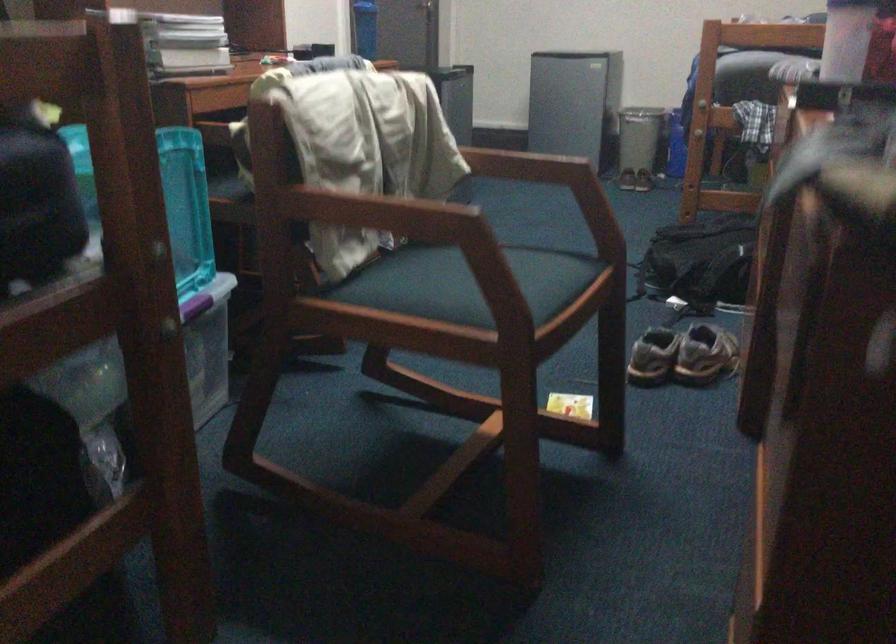
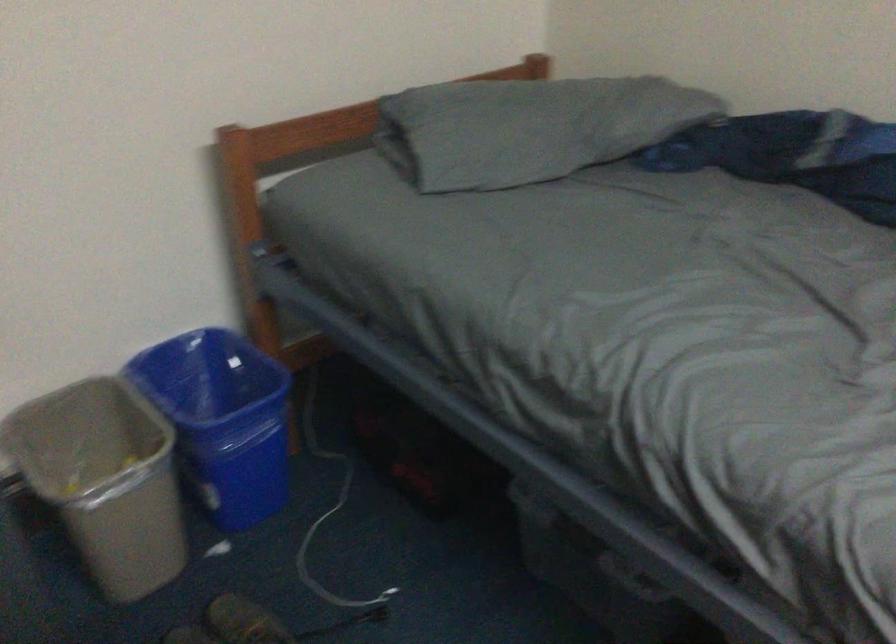
In the second image, find the point that corresponds to point (666, 80) in the first image.

(221, 420)